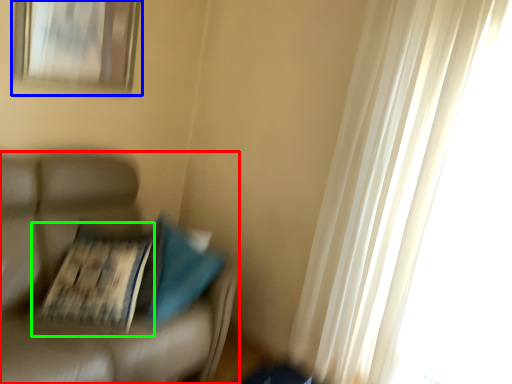
Question: Which object is the closest to the furniture (highlighted by a red box)? Choose among these: picture frame (highlighted by a blue box) or magazine (highlighted by a green box).

Choices:
 (A) picture frame
 (B) magazine

Answer: (B)